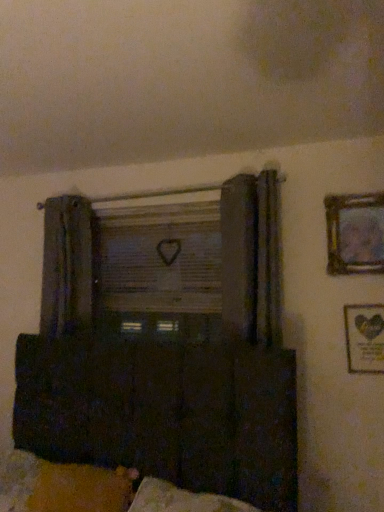
Question: Would you say velvety yellow pillow at lower left is to the left or to the right of wooden window screen at center in the picture?

Choices:
 (A) right
 (B) left

Answer: (B)

Question: Considering the positions of velvety yellow pillow at lower left and wooden window screen at center in the image, is velvety yellow pillow at lower left taller or shorter than wooden window screen at center?

Choices:
 (A) tall
 (B) short

Answer: (B)

Question: Which object is positioned farthest from the wooden picture frame at upper right, arranged as the first picture frame when viewed from the top?

Choices:
 (A) dark wood cabinet at lower center
 (B) wooden window screen at center
 (C) wooden framed picture at lower right, placed as the 2th picture frame when sorted from top to bottom
 (D) velvety yellow pillow at lower left

Answer: (D)

Question: Considering the real-world distances, which object is closest to the wooden picture frame at upper right, arranged as the first picture frame when viewed from the top?

Choices:
 (A) dark wood cabinet at lower center
 (B) wooden window screen at center
 (C) wooden framed picture at lower right, which is counted as the first picture frame, starting from the bottom
 (D) velvety yellow pillow at lower left

Answer: (C)